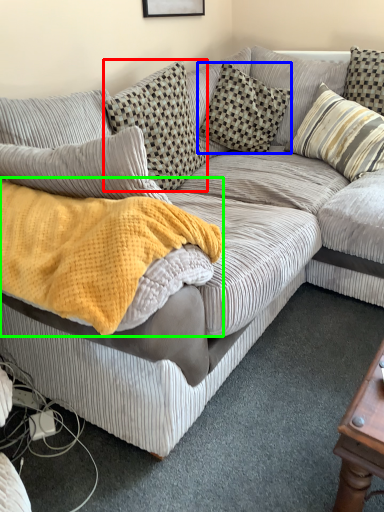
Question: Which object is the farthest from pillow (highlighted by a red box)? Choose among these: pillow (highlighted by a blue box) or blanket (highlighted by a green box).

Choices:
 (A) pillow
 (B) blanket

Answer: (B)